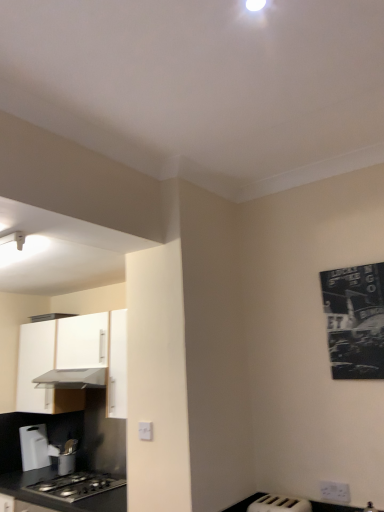
Identify the location of blank space above white plastic toaster at lower right, the 2th appliance when ordered from bottom to top (from a real-world perspective). (278, 502).